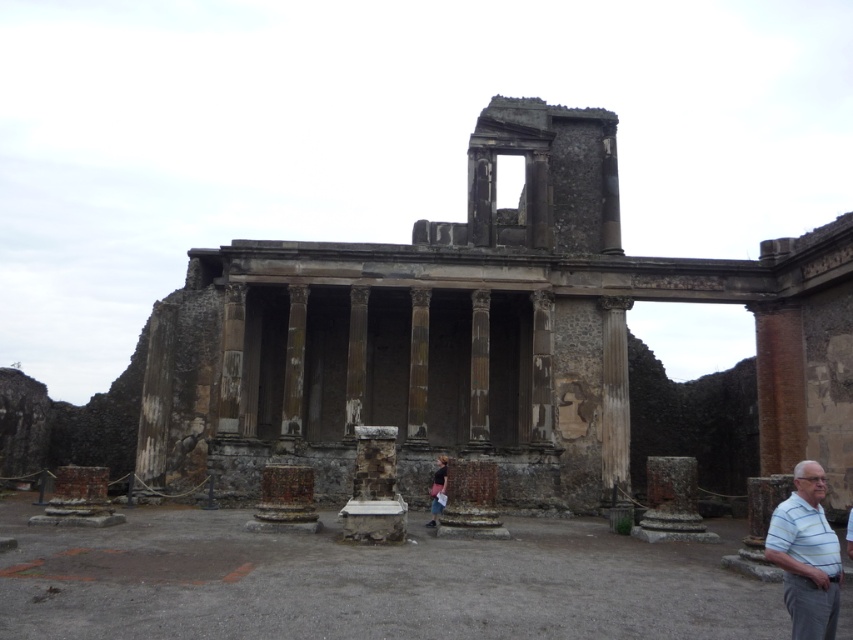
Can you confirm if rusty stone columns at center is thinner than weathered stone column at center?

Incorrect, rusty stone columns at center's width is not less than weathered stone column at center's.

This screenshot has width=853, height=640. What do you see at coordinates (477, 333) in the screenshot? I see `rusty stone columns at center` at bounding box center [477, 333].

Find the location of a particular element. rusty stone columns at center is located at coordinates [x=477, y=333].

Based on the photo, is white striped shirt at lower right to the right of denim jacket at center from the viewer's perspective?

Yes, white striped shirt at lower right is to the right of denim jacket at center.

Between point (805, 481) and point (438, 464), which one is positioned behind?

The point (438, 464) is more distant.

Is point (773, 515) closer to viewer compared to point (440, 492)?

Yes, it is.

Find the location of `white striped shirt at lower right`. white striped shirt at lower right is located at coordinates (805, 556).

Is weathered stone column at center further to the viewer compared to denim jacket at center?

Yes, it is behind denim jacket at center.

Where is `weathered stone column at center`? weathered stone column at center is located at coordinates (614, 401).